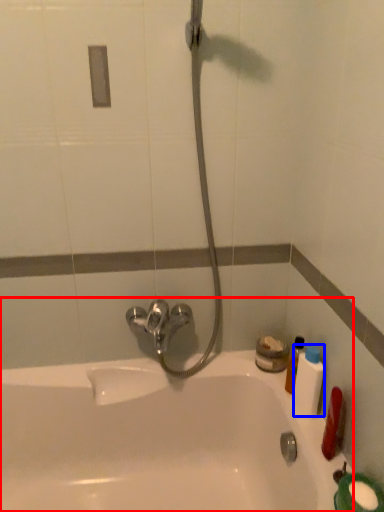
Question: Which point is further to the camera, bathtub (highlighted by a red box) or mouthwash (highlighted by a blue box)?

Choices:
 (A) bathtub
 (B) mouthwash

Answer: (B)